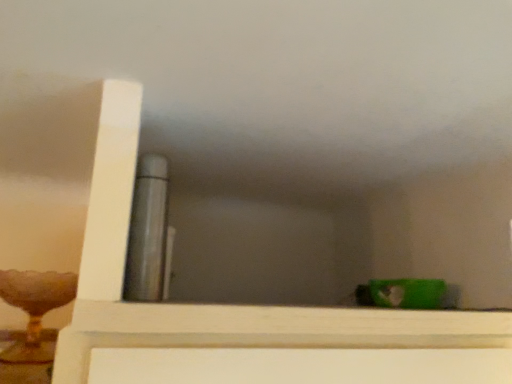
What do you see at coordinates (35, 309) in the screenshot?
I see `translucent amber glass at left` at bounding box center [35, 309].

Locate an element on the screen. The image size is (512, 384). translucent amber glass at left is located at coordinates (35, 309).

In order to face translucent amber glass at left, should I rotate leftwards or rightwards?

A 26.502 degree turn to the left will do.

What are the coordinates of `translucent amber glass at left` in the screenshot? It's located at (35, 309).